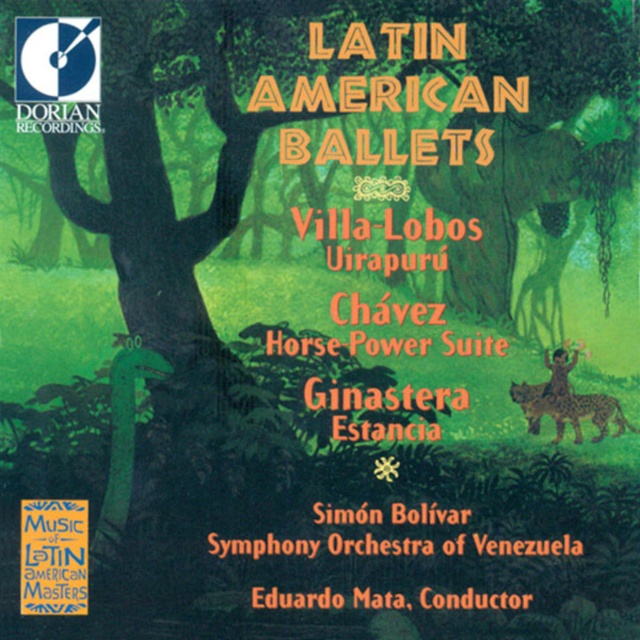
Question: Where is spotted fur hyena at center located in relation to brown fur jaguar at upper right in the image?

Choices:
 (A) right
 (B) left

Answer: (A)

Question: Which point is farther to the camera?

Choices:
 (A) brown fur jaguar at upper right
 (B) spotted fur hyena at center

Answer: (A)

Question: Among these objects, which one is farthest from the camera?

Choices:
 (A) brown fur jaguar at upper right
 (B) spotted fur hyena at center

Answer: (A)

Question: Can you confirm if spotted fur hyena at center is thinner than brown fur jaguar at upper right?

Choices:
 (A) no
 (B) yes

Answer: (A)

Question: Which object is closer to the camera taking this photo?

Choices:
 (A) spotted fur hyena at center
 (B) brown fur jaguar at upper right

Answer: (A)

Question: Is spotted fur hyena at center above brown fur jaguar at upper right?

Choices:
 (A) no
 (B) yes

Answer: (A)